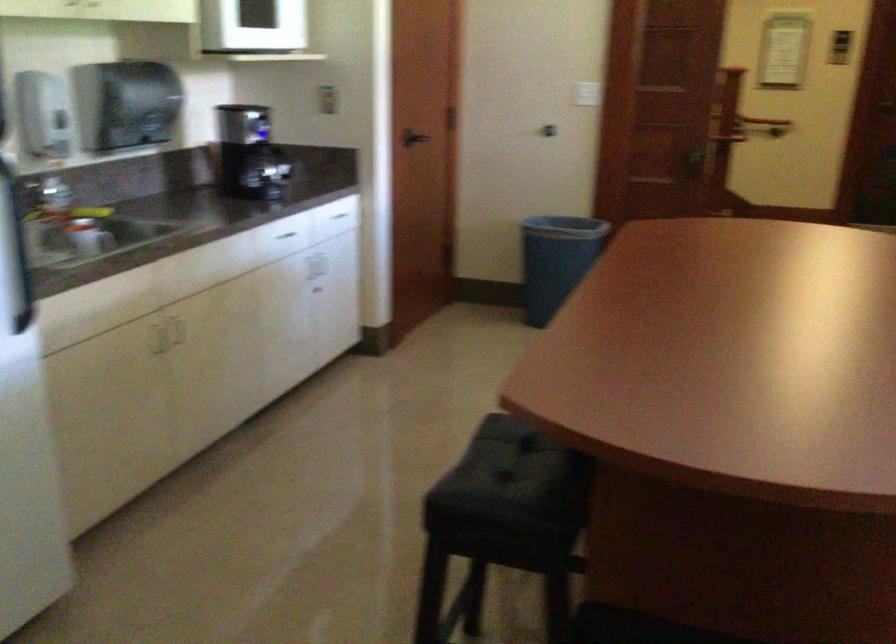
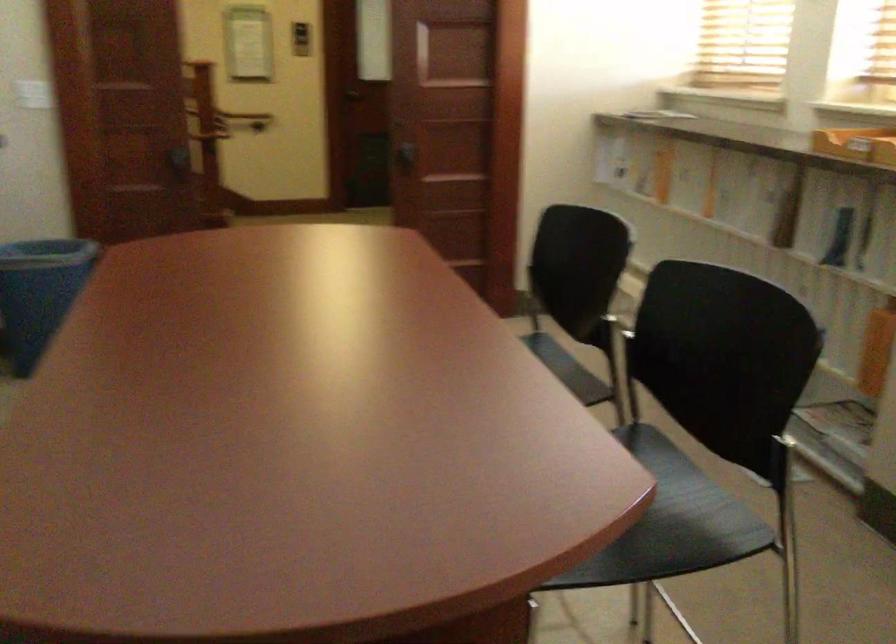
Locate, in the second image, the point that corresponds to point (548, 254) in the first image.

(39, 294)